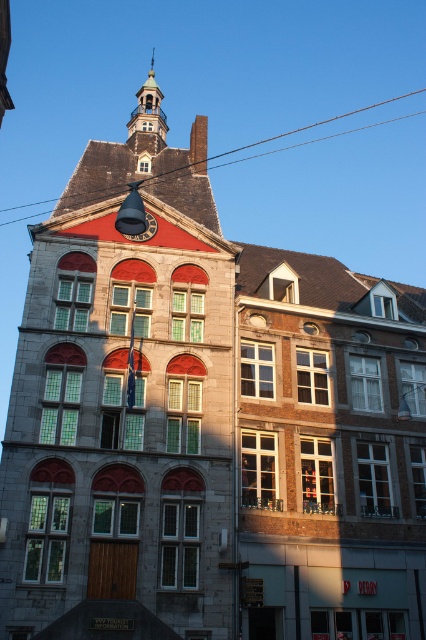
Who is shorter, polished brass bell tower at center or gold polished metal spire at upper center?

With less height is polished brass bell tower at center.

Is polished brass bell tower at center thinner than gold polished metal spire at upper center?

Yes, polished brass bell tower at center is thinner than gold polished metal spire at upper center.

This screenshot has height=640, width=426. Find the location of `polished brass bell tower at center`. polished brass bell tower at center is located at coordinates (123, 406).